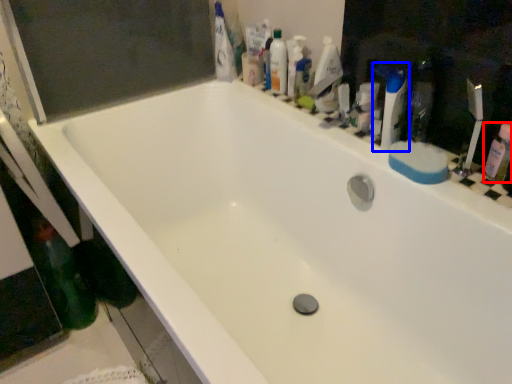
Question: Which point is closer to the camera, mouthwash (highlighted by a red box) or toiletry (highlighted by a blue box)?

Choices:
 (A) mouthwash
 (B) toiletry

Answer: (A)